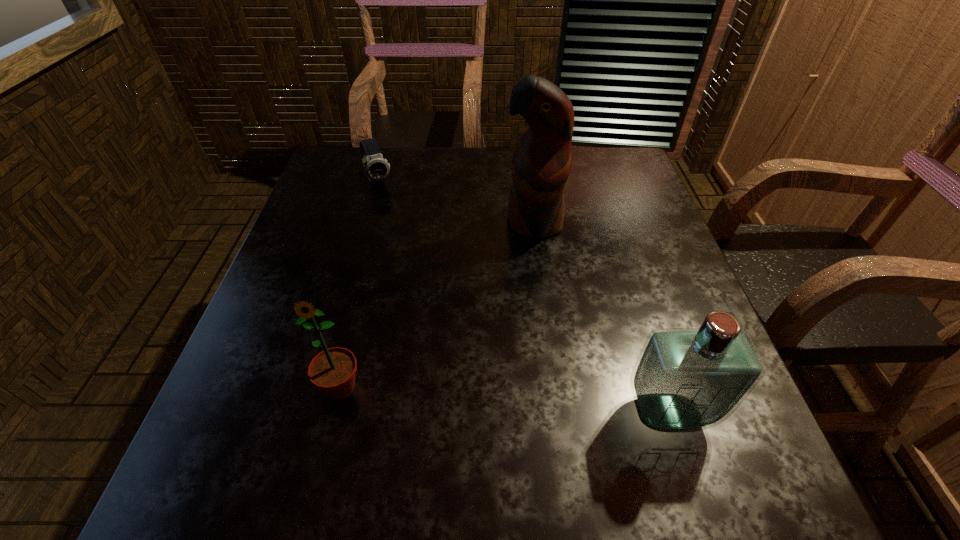
The image size is (960, 540). I want to click on vacant spot on the desktop that is between the sunflower and the rightmost object and is positioned on the face of the shortest object, so click(x=496, y=400).

I want to click on vacant space on the desktop that is between the sunflower and the perfume and is positioned on the face of the third object from left to right, so click(477, 398).